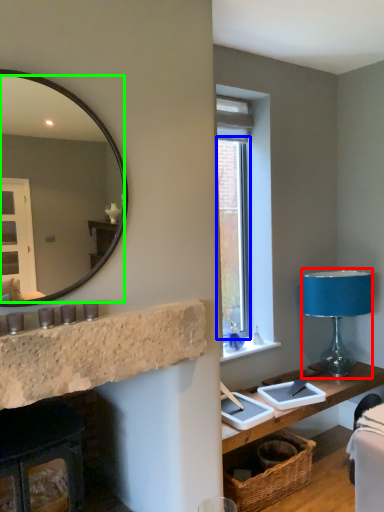
Question: Which object is positioned closest to table lamp (highlighted by a red box)? Select from window (highlighted by a blue box) and mirror (highlighted by a green box).

Choices:
 (A) window
 (B) mirror

Answer: (A)